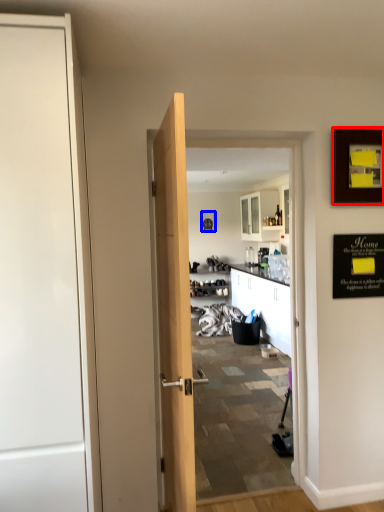
Question: Which point is closer to the camera, picture frame (highlighted by a red box) or picture frame (highlighted by a blue box)?

Choices:
 (A) picture frame
 (B) picture frame

Answer: (A)